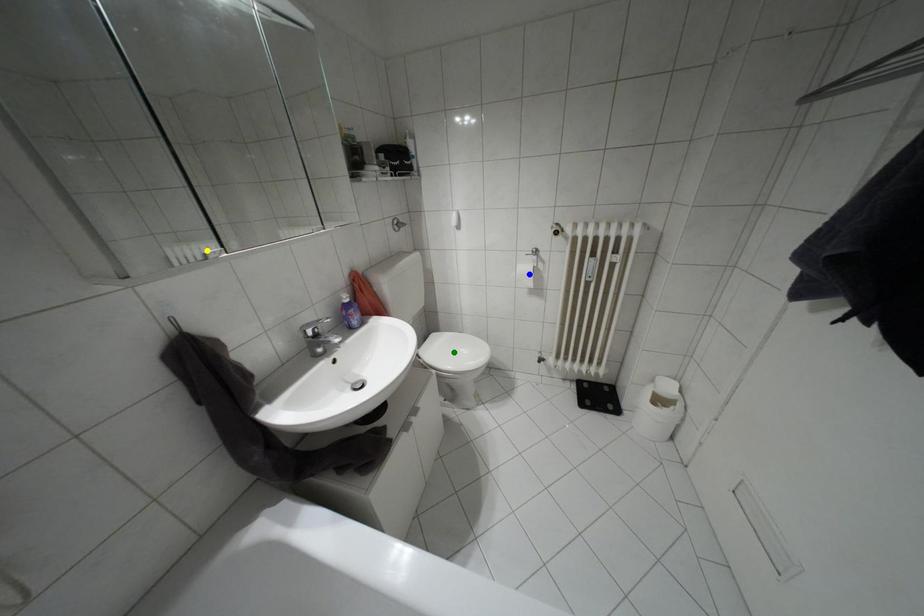
In the scene shown: Order these from nearest to farthest:
yellow point | blue point | green point

yellow point < blue point < green point